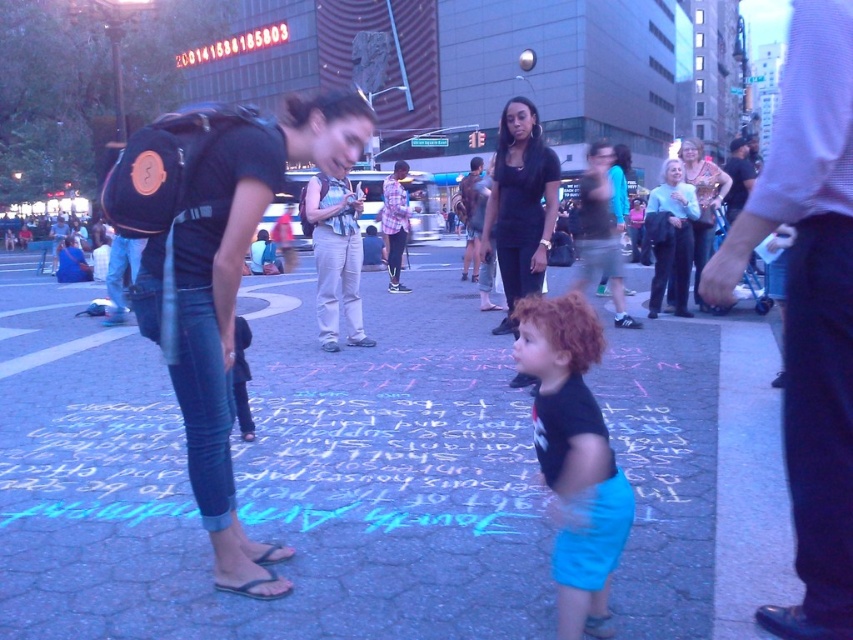
Question: Can you confirm if blue brick pavement at center is positioned below black fabric shirt at center?

Choices:
 (A) yes
 (B) no

Answer: (A)

Question: In this image, where is black fabric shirt at center located relative to black matte shirt at center?

Choices:
 (A) left
 (B) right

Answer: (B)

Question: Which is farther from the black fabric shirt at center?

Choices:
 (A) blue brick pavement at center
 (B) light blue sweater at upper right
 (C) matte black tank top at center
 (D) black matte shirt at center

Answer: (C)

Question: Is black fabric shirt at center bigger than light blue sweater at upper right?

Choices:
 (A) no
 (B) yes

Answer: (B)

Question: Which object appears closest to the camera in this image?

Choices:
 (A) light blue sweater at upper right
 (B) matte black tank top at center

Answer: (B)

Question: Which point appears closest to the camera in this image?

Choices:
 (A) (526, 241)
 (B) (670, 173)
 (C) (721, 320)

Answer: (A)